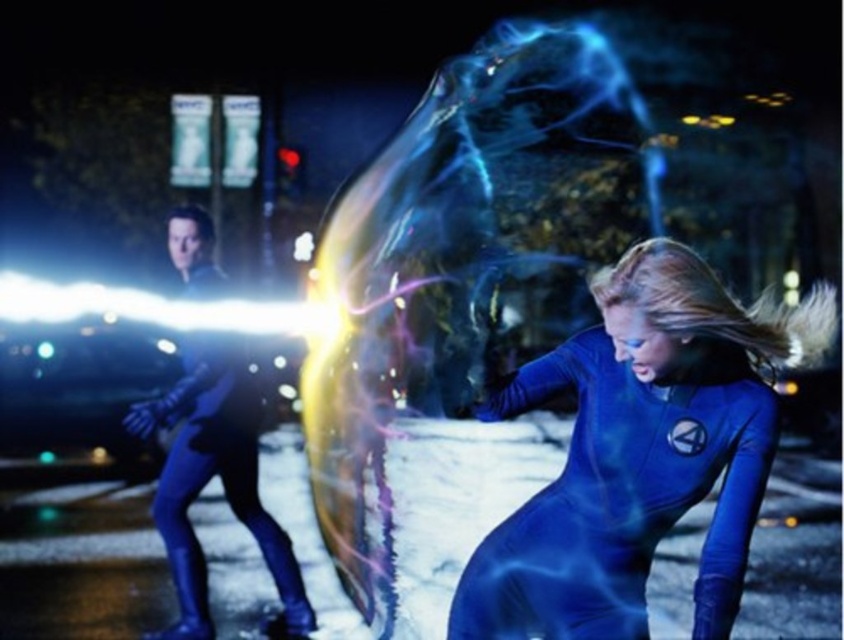
Question: Is blue spandex suit at lower right to the right of matte blue suit at left from the viewer's perspective?

Choices:
 (A) no
 (B) yes

Answer: (B)

Question: Is blue spandex suit at lower right positioned in front of matte blue suit at left?

Choices:
 (A) yes
 (B) no

Answer: (A)

Question: Among these points, which one is farthest from the camera?

Choices:
 (A) (191, 240)
 (B) (621, 337)

Answer: (A)

Question: Does blue spandex suit at lower right have a lesser width compared to matte blue suit at left?

Choices:
 (A) no
 (B) yes

Answer: (A)

Question: Among these points, which one is farthest from the camera?

Choices:
 (A) (234, 476)
 (B) (729, 337)

Answer: (A)